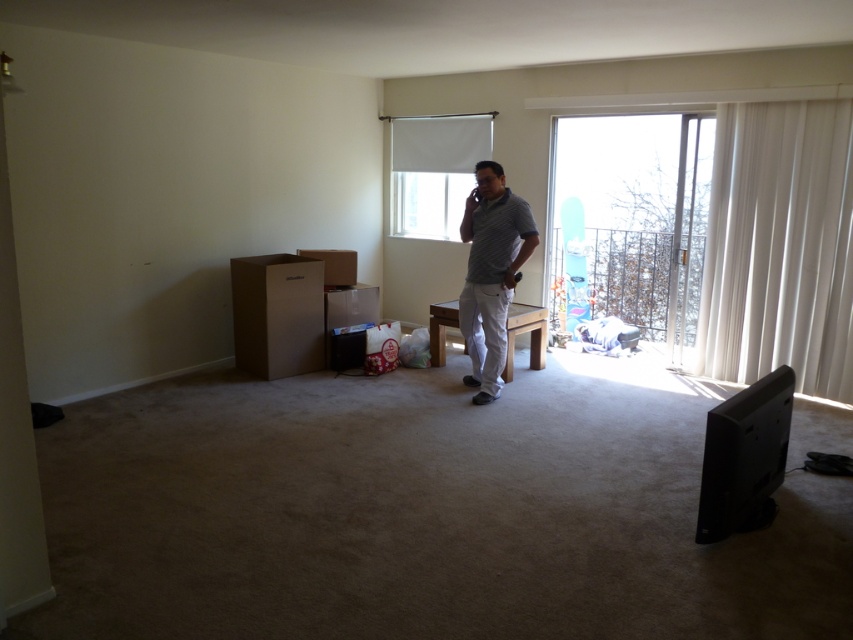
Can you confirm if gray striped shirt at center is positioned to the left of brown cardboard box at left?

No, gray striped shirt at center is not to the left of brown cardboard box at left.

Which is more to the right, gray striped shirt at center or brown cardboard box at left?

gray striped shirt at center is more to the right.

Describe the element at coordinates (491, 273) in the screenshot. I see `gray striped shirt at center` at that location.

Where is `gray striped shirt at center`? This screenshot has height=640, width=853. gray striped shirt at center is located at coordinates (491, 273).

Measure the distance from transparent glass window at right to gray striped shirt at center.

A distance of 4.18 meters exists between transparent glass window at right and gray striped shirt at center.

Does transparent glass window at right have a lesser height compared to gray striped shirt at center?

In fact, transparent glass window at right may be taller than gray striped shirt at center.

Is point (653, 339) farther from viewer compared to point (467, 353)?

Yes, point (653, 339) is behind point (467, 353).

Locate an element on the screen. The width and height of the screenshot is (853, 640). transparent glass window at right is located at coordinates (631, 221).

The height and width of the screenshot is (640, 853). I want to click on cardboard box at left, so click(277, 314).

Where is `cardboard box at left`? The height and width of the screenshot is (640, 853). cardboard box at left is located at coordinates (277, 314).

Locate an element on the screen. The height and width of the screenshot is (640, 853). cardboard box at left is located at coordinates (277, 314).